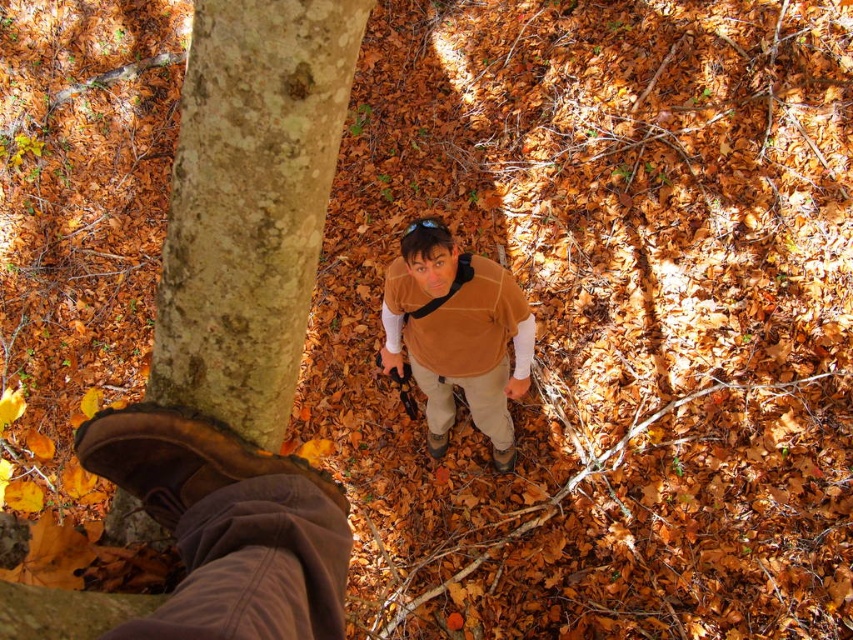
You are trying to decide whether to sit against the smooth bark tree trunk at center or the brown suede vest at center. Which one is shorter and thus more comfortable for sitting?

The smooth bark tree trunk at center is shorter than the brown suede vest at center, making it more comfortable for sitting.

You are standing in the autumn forest and see the smooth bark tree trunk at center and the brown suede vest at center. Which object is closer to you?

The smooth bark tree trunk at center is closer to you because it is positioned over the brown suede vest at center, indicating it is in a higher layer.

You are trying to decide whether to place a small potted plant next to the smooth bark tree trunk at center or the brown suede vest at center. Based on their sizes, which object would allow the plant to fit better beside it?

The smooth bark tree trunk at center is smaller in size compared to the brown suede vest at center, so placing the small potted plant next to the smooth bark tree trunk at center would provide more space and better fit.